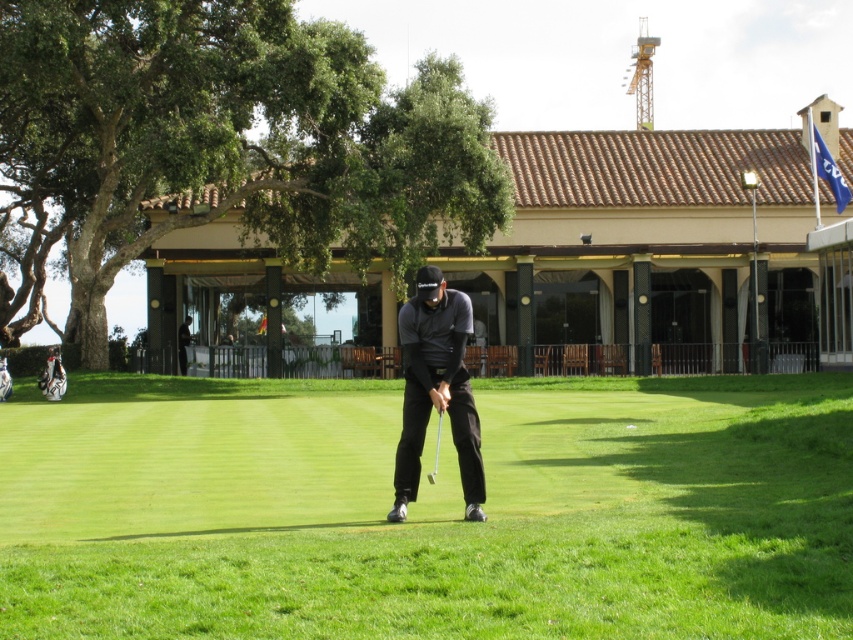
Is point (297, 554) farther from camera compared to point (431, 477)?

No, (297, 554) is in front of (431, 477).

Which is in front, point (531, 394) or point (434, 452)?

Point (434, 452) is more forward.

Is point (700, 422) farther from viewer compared to point (434, 467)?

Yes, it is behind point (434, 467).

In order to click on green grass at center in this screenshot , I will do `click(428, 512)`.

Is the position of green grass at center more distant than that of black matte golf club at center?

That is False.

Which is more to the left, green grass at center or black matte golf club at center?

From the viewer's perspective, black matte golf club at center appears more on the left side.

Which is in front, point (527, 577) or point (468, 433)?

Positioned in front is point (527, 577).

You are a GUI agent. You are given a task and a screenshot of the screen. Output one action in this format:
    pyautogui.click(x=<x>, y=<y>)
    Task: Click on the green grass at center
    Image resolution: width=853 pixels, height=640 pixels.
    Given the screenshot: What is the action you would take?
    [x=428, y=512]

Can you confirm if black matte golf club at center is positioned above metallic silver golf club at center?

Yes.

Does black matte golf club at center have a greater height compared to metallic silver golf club at center?

Indeed, black matte golf club at center has a greater height compared to metallic silver golf club at center.

What do you see at coordinates (436, 388) in the screenshot? The image size is (853, 640). I see `black matte golf club at center` at bounding box center [436, 388].

In order to click on black matte golf club at center in this screenshot , I will do `click(436, 388)`.